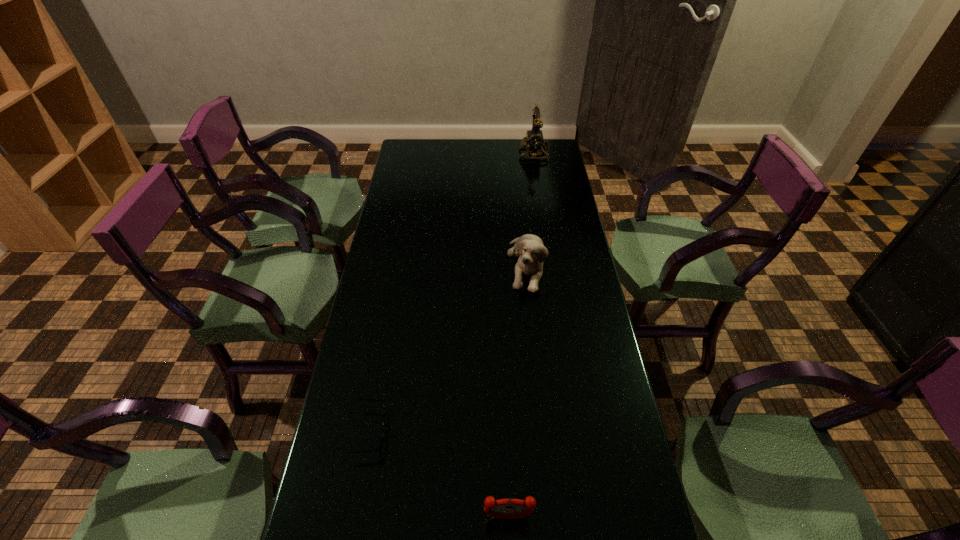
This screenshot has width=960, height=540. I want to click on the tallest object, so click(534, 138).

Locate an element on the screen. Image resolution: width=960 pixels, height=540 pixels. telephone is located at coordinates (534, 138).

I want to click on the second farthest object, so click(x=532, y=252).

Find the location of `the third shortest object`. the third shortest object is located at coordinates (532, 252).

I want to click on the second shortest object, so click(509, 508).

Where is `alarm clock`? This screenshot has width=960, height=540. alarm clock is located at coordinates (509, 508).

Image resolution: width=960 pixels, height=540 pixels. Identify the location of the third farthest object. (378, 446).

Locate an element on the screen. This screenshot has width=960, height=540. the leftmost object is located at coordinates (378, 446).

You are a GUI agent. You are given a task and a screenshot of the screen. Output one action in this format:
    pyautogui.click(x=<x>, y=<y>)
    Task: Click on the free space located 0.110m on the front of the tallest object, featuring the rotary dial
    
    Given the screenshot: What is the action you would take?
    pyautogui.click(x=495, y=153)

Identify the location of free space located 0.260m on the front of the tallest object, featuring the rotary dial. (464, 153).